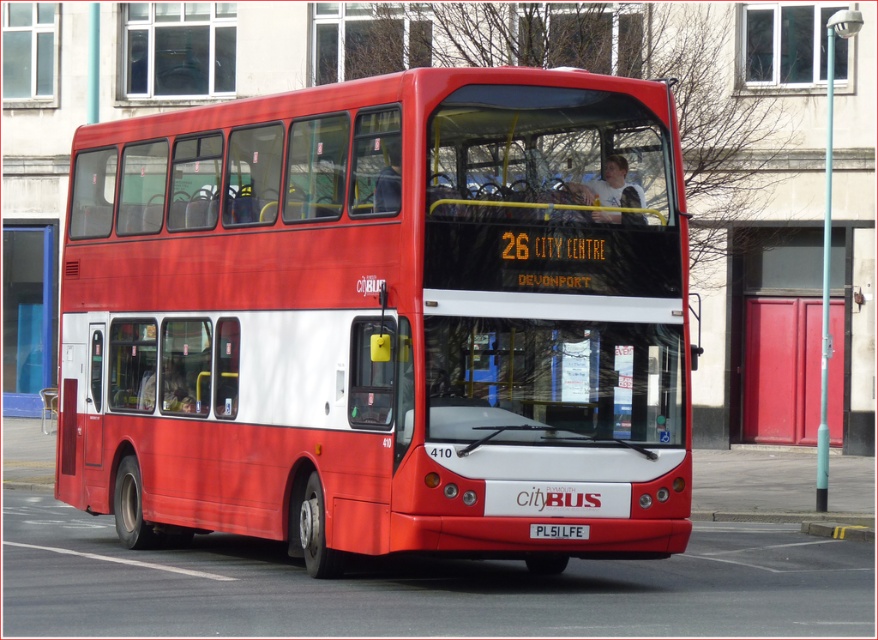
Does point (408, 408) lie behind point (562, 532)?

No, (408, 408) is closer to viewer.

Which is behind, point (479, 500) or point (545, 538)?

Positioned behind is point (545, 538).

This screenshot has width=878, height=640. I want to click on matte red bus at center, so click(x=384, y=317).